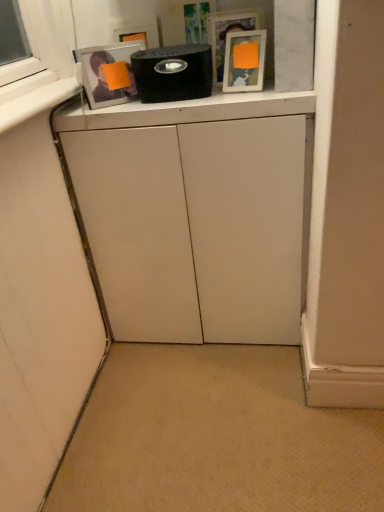
This screenshot has width=384, height=512. I want to click on blank space situated above white matte cabinet at center (from a real-world perspective), so click(x=170, y=100).